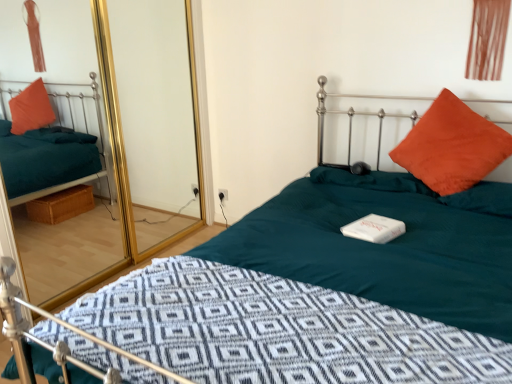
Question: Does transparent glass door at upper left lie in front of orange suede pillow at upper right?

Choices:
 (A) yes
 (B) no

Answer: (A)

Question: From the image's perspective, is transparent glass door at upper left under orange suede pillow at upper right?

Choices:
 (A) yes
 (B) no

Answer: (B)

Question: Does transparent glass door at upper left have a greater width compared to orange suede pillow at upper right?

Choices:
 (A) yes
 (B) no

Answer: (B)

Question: Is transparent glass door at upper left outside orange suede pillow at upper right?

Choices:
 (A) no
 (B) yes

Answer: (B)

Question: Is transparent glass door at upper left aimed at orange suede pillow at upper right?

Choices:
 (A) yes
 (B) no

Answer: (A)

Question: From the image's perspective, is orange suede pillow at upper right positioned above or below brown fabric curtain at upper right?

Choices:
 (A) below
 (B) above

Answer: (A)

Question: Is point (417, 140) positioned closer to the camera than point (504, 3)?

Choices:
 (A) closer
 (B) farther

Answer: (B)

Question: Based on their positions, is orange suede pillow at upper right located to the left or right of brown fabric curtain at upper right?

Choices:
 (A) right
 (B) left

Answer: (B)

Question: Based on their sizes in the image, would you say orange suede pillow at upper right is bigger or smaller than brown fabric curtain at upper right?

Choices:
 (A) small
 (B) big

Answer: (B)

Question: From a real-world perspective, is orange suede pillow at upper right physically located above or below transparent glass door at upper left?

Choices:
 (A) above
 (B) below

Answer: (B)

Question: In terms of width, does orange suede pillow at upper right look wider or thinner when compared to transparent glass door at upper left?

Choices:
 (A) thin
 (B) wide

Answer: (B)

Question: Considering the relative positions of orange suede pillow at upper right and transparent glass door at upper left in the image provided, is orange suede pillow at upper right to the left or to the right of transparent glass door at upper left?

Choices:
 (A) right
 (B) left

Answer: (A)

Question: Is orange suede pillow at upper right inside or outside of transparent glass door at upper left?

Choices:
 (A) inside
 (B) outside

Answer: (B)

Question: Is point (152, 102) positioned closer to the camera than point (484, 74)?

Choices:
 (A) farther
 (B) closer

Answer: (A)

Question: In terms of size, does transparent glass door at upper left appear bigger or smaller than brown fabric curtain at upper right?

Choices:
 (A) big
 (B) small

Answer: (A)